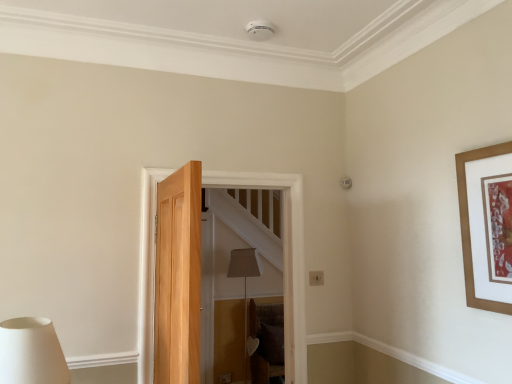
This screenshot has height=384, width=512. Describe the element at coordinates (284, 256) in the screenshot. I see `wooden door at center` at that location.

Where is `wooden door at center`? This screenshot has height=384, width=512. wooden door at center is located at coordinates (284, 256).

I want to click on wooden door at center, so click(284, 256).